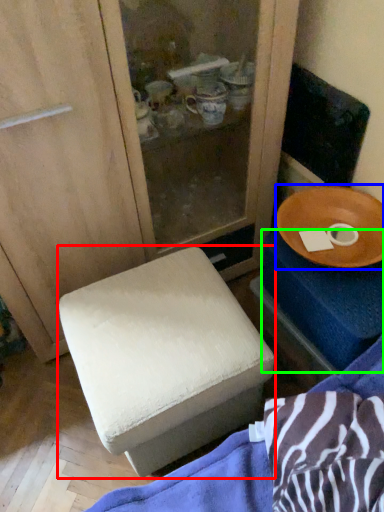
Question: Which object is the closest to the furniture (highlighted by a red box)? Choose among these: tableware (highlighted by a blue box) or changing table (highlighted by a green box).

Choices:
 (A) tableware
 (B) changing table

Answer: (B)